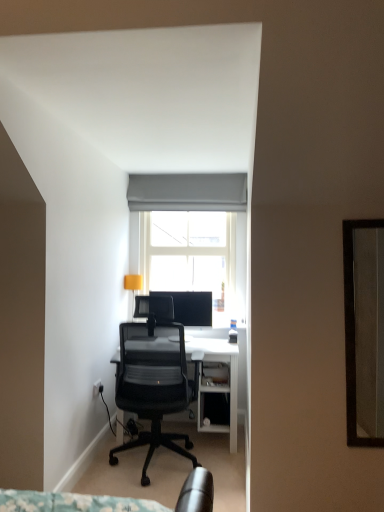
Question: Considering the positions of matte yellow lampshade at upper left and gray fabric curtain at upper center in the image, is matte yellow lampshade at upper left bigger or smaller than gray fabric curtain at upper center?

Choices:
 (A) small
 (B) big

Answer: (A)

Question: In the image, is matte yellow lampshade at upper left positioned in front of or behind gray fabric curtain at upper center?

Choices:
 (A) front
 (B) behind

Answer: (B)

Question: Estimate the real-world distances between objects in this image. Which object is farther from the white glass window at center?

Choices:
 (A) matte yellow lampshade at upper left
 (B) gray fabric curtain at upper center
 (C) black mesh office chair at center
 (D) matte black monitor at center

Answer: (C)

Question: Which is farther from the matte yellow lampshade at upper left?

Choices:
 (A) gray fabric curtain at upper center
 (B) black mesh office chair at center
 (C) white glass window at center
 (D) matte black monitor at center

Answer: (B)